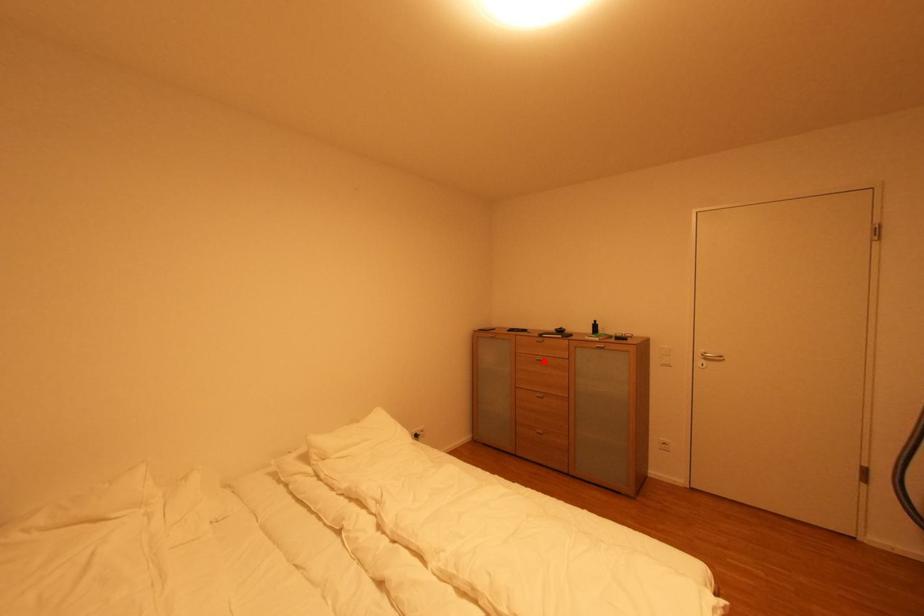
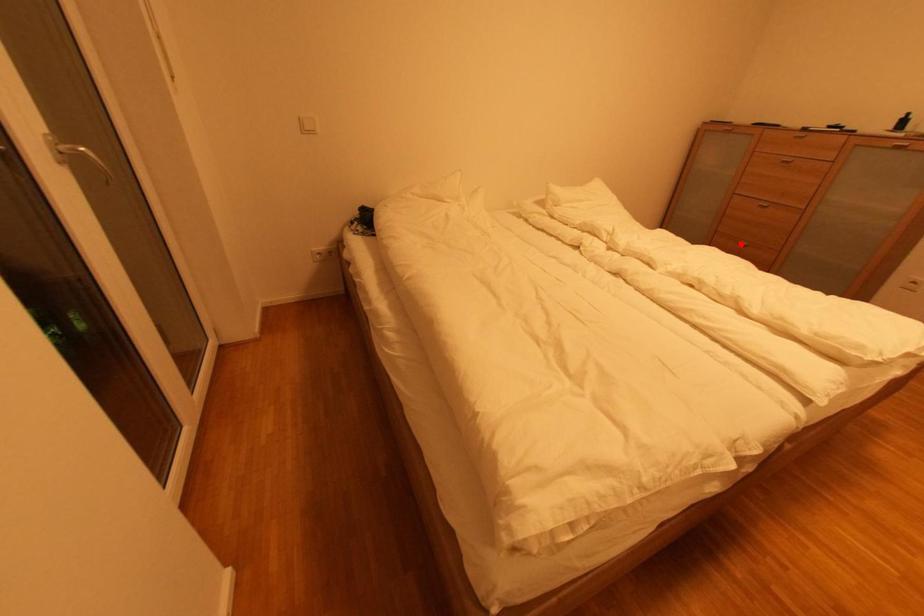
I am providing you with two images of the same scene from different viewpoints. A red point is marked on the first image and another point is marked on the second image. Do the highlighted points in image1 and image2 indicate the same real-world spot?

No